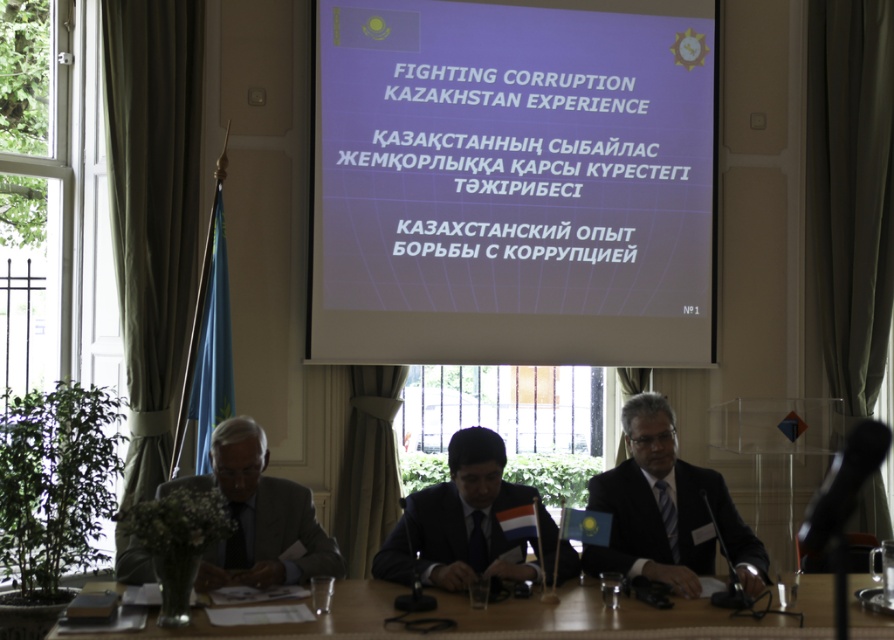
Can you confirm if wooden table at center is positioned to the right of dark suit at center?

No, wooden table at center is not to the right of dark suit at center.

Measure the distance from wooden table at center to dark suit at center.

The distance of wooden table at center from dark suit at center is 17.65 inches.

Where is `wooden table at center`? wooden table at center is located at coordinates (631, 616).

Is the position of wooden table at center more distant than that of dark blue suit at center?

No, it is not.

Between point (513, 627) and point (523, 540), which one is positioned behind?

Point (523, 540)

Where is `wooden table at center`? The image size is (894, 640). wooden table at center is located at coordinates (631, 616).

Locate an element on the screen. wooden table at center is located at coordinates (631, 616).

Is the position of white glossy projection screen at center more distant than that of wooden table at center?

Yes, it is behind wooden table at center.

Can you confirm if white glossy projection screen at center is positioned above wooden table at center?

Indeed, white glossy projection screen at center is positioned over wooden table at center.

Find the location of a particular element. Image resolution: width=894 pixels, height=640 pixels. white glossy projection screen at center is located at coordinates (513, 182).